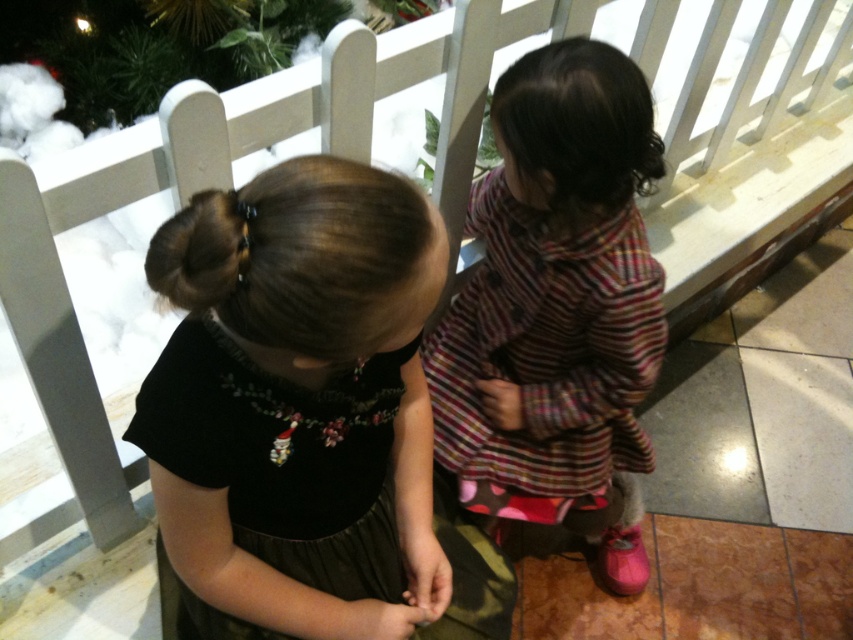
Question: Can you confirm if striped fabric dress at center is wider than black velvet dress at center?

Choices:
 (A) yes
 (B) no

Answer: (B)

Question: Observing the image, what is the correct spatial positioning of striped fabric dress at center in reference to black velvet dress at center?

Choices:
 (A) left
 (B) right

Answer: (B)

Question: Which of the following is the farthest from the observer?

Choices:
 (A) (630, 577)
 (B) (263, 372)

Answer: (A)

Question: Is striped fabric dress at center to the right of black velvet dress at center from the viewer's perspective?

Choices:
 (A) no
 (B) yes

Answer: (B)